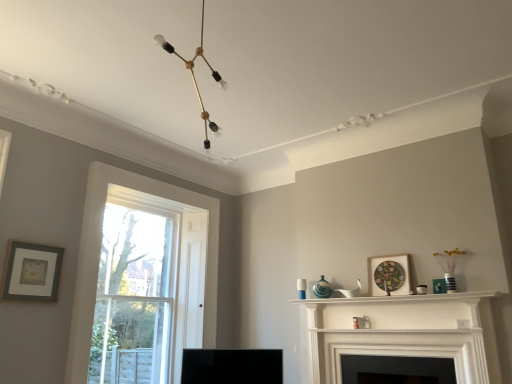
Question: Could you tell me if matte gray picture frame at left, the 2th picture frame when ordered from right to left, is turned towards white glossy shelf at upper center?

Choices:
 (A) yes
 (B) no

Answer: (B)

Question: Considering the relative positions of matte gray picture frame at left, arranged as the 1th picture frame when viewed from the left, and white glossy shelf at upper center in the image provided, is matte gray picture frame at left, arranged as the 1th picture frame when viewed from the left, to the left of white glossy shelf at upper center from the viewer's perspective?

Choices:
 (A) no
 (B) yes

Answer: (B)

Question: Are matte gray picture frame at left, arranged as the 1th picture frame when viewed from the left, and white glossy shelf at upper center located far from each other?

Choices:
 (A) no
 (B) yes

Answer: (B)

Question: From a real-world perspective, is matte gray picture frame at left, the 2th picture frame when ordered from right to left, physically above white glossy shelf at upper center?

Choices:
 (A) yes
 (B) no

Answer: (A)

Question: From the image's perspective, would you say matte gray picture frame at left, arranged as the 1th picture frame when viewed from the left, is shown under white glossy shelf at upper center?

Choices:
 (A) no
 (B) yes

Answer: (A)

Question: Can you confirm if matte gray picture frame at left, arranged as the 1th picture frame when viewed from the left, is wider than white glossy shelf at upper center?

Choices:
 (A) no
 (B) yes

Answer: (A)

Question: Considering the relative sizes of clear glass window at left and matte gray picture frame at left, the 2th picture frame when ordered from right to left, in the image provided, is clear glass window at left taller than matte gray picture frame at left, the 2th picture frame when ordered from right to left,?

Choices:
 (A) no
 (B) yes

Answer: (B)

Question: Could you tell me if clear glass window at left is facing matte gray picture frame at left, arranged as the 1th picture frame when viewed from the left?

Choices:
 (A) no
 (B) yes

Answer: (A)

Question: Is clear glass window at left surrounding matte gray picture frame at left, the 2th picture frame when ordered from right to left?

Choices:
 (A) yes
 (B) no

Answer: (B)

Question: Is clear glass window at left shorter than matte gray picture frame at left, the 2th picture frame when ordered from right to left?

Choices:
 (A) no
 (B) yes

Answer: (A)

Question: From a real-world perspective, is clear glass window at left below matte gray picture frame at left, the 2th picture frame when ordered from right to left?

Choices:
 (A) no
 (B) yes

Answer: (B)

Question: Is clear glass window at left bigger than matte gray picture frame at left, the 2th picture frame when ordered from right to left?

Choices:
 (A) no
 (B) yes

Answer: (B)

Question: Can you confirm if white matte fireplace at center, which is the 1th fireplace from top to bottom, is shorter than black matte fireplace at center, the first fireplace when ordered from bottom to top?

Choices:
 (A) no
 (B) yes

Answer: (A)